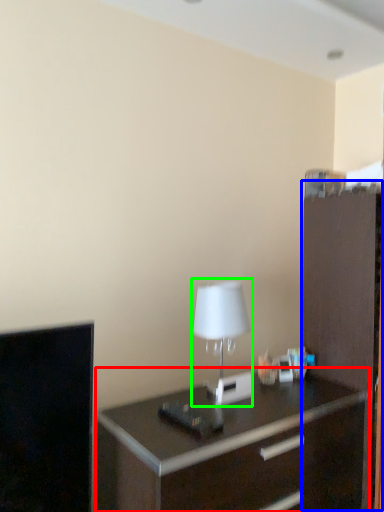
Question: Which object is positioned closest to chest of drawers (highlighted by a red box)? Select from file cabinet (highlighted by a blue box) and table lamp (highlighted by a green box).

Choices:
 (A) file cabinet
 (B) table lamp

Answer: (A)